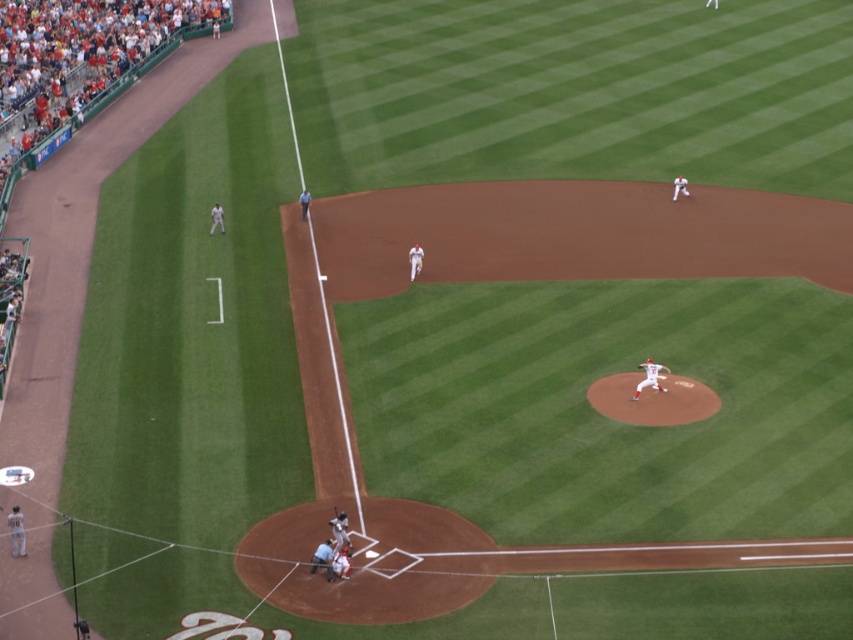
Question: Can you confirm if white matte bat at lower center is positioned below wooden bat at home plate?

Choices:
 (A) yes
 (B) no

Answer: (A)

Question: Which point is farther to the camera?

Choices:
 (A) (329, 561)
 (B) (648, 385)
 (C) (334, 516)
 (D) (344, 518)

Answer: (B)

Question: Which object appears farthest from the camera in this image?

Choices:
 (A) wooden bat at home plate
 (B) white matte bat at lower center
 (C) white matte baseball pitcher at center

Answer: (C)

Question: Is white matte baseball pitcher at center positioned behind wooden bat at home plate?

Choices:
 (A) yes
 (B) no

Answer: (A)

Question: Is white fabric referee at lower center to the left of wooden bat at home plate from the viewer's perspective?

Choices:
 (A) no
 (B) yes

Answer: (B)

Question: Which object is closer to the camera taking this photo?

Choices:
 (A) white fabric referee at lower center
 (B) white matte baseball pitcher at center
 (C) wooden bat at home plate

Answer: (A)